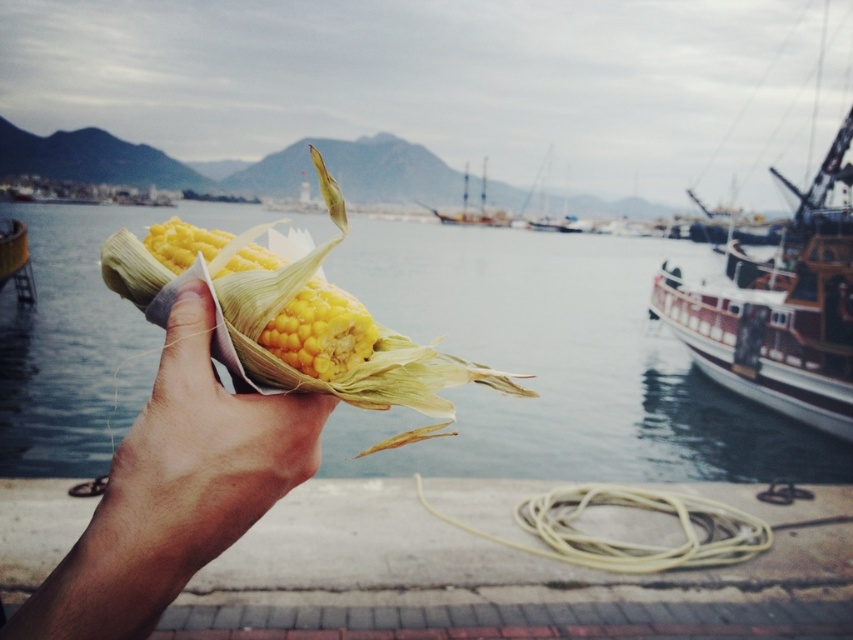
Does smooth skin hand at center have a greater width compared to wooden ship at right?

Yes.

Which is more to the right, smooth skin hand at center or wooden ship at right?

Positioned to the right is wooden ship at right.

Which is behind, point (83, 561) or point (782, 372)?

Point (782, 372)

Image resolution: width=853 pixels, height=640 pixels. What are the coordinates of `smooth skin hand at center` in the screenshot? It's located at (175, 490).

Can you confirm if translucent water at corn left is bigger than wooden ship at right?

Indeed, translucent water at corn left has a larger size compared to wooden ship at right.

Who is more distant from viewer, (552, 243) or (706, 369)?

Point (552, 243)

Locate an element on the screen. Image resolution: width=853 pixels, height=640 pixels. translucent water at corn left is located at coordinates pos(556,364).

Where is `translucent water at corn left`? translucent water at corn left is located at coordinates click(556, 364).

Is translucent water at corn left closer to camera compared to wooden ship at center?

Yes, translucent water at corn left is closer to the viewer.

Does translucent water at corn left have a lesser width compared to wooden ship at center?

No.

At what (x,y) coordinates should I click in order to perform the action: click on translucent water at corn left. Please return your answer as a coordinate pair (x, y). This screenshot has height=640, width=853. Looking at the image, I should click on (556, 364).

Locate an element on the screen. The height and width of the screenshot is (640, 853). translucent water at corn left is located at coordinates (556, 364).